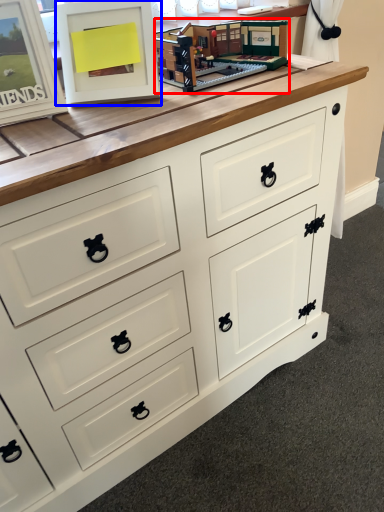
Question: Which of the following is the closest to the observer, toy (highlighted by a red box) or picture frame (highlighted by a blue box)?

Choices:
 (A) toy
 (B) picture frame

Answer: (B)